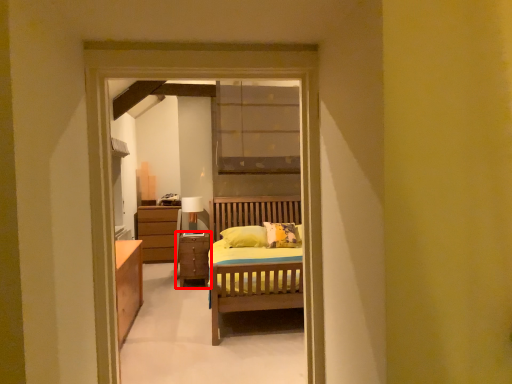
Question: Where is chest of drawers (annotated by the red box) located in relation to table lamp in the image?

Choices:
 (A) left
 (B) right

Answer: (B)